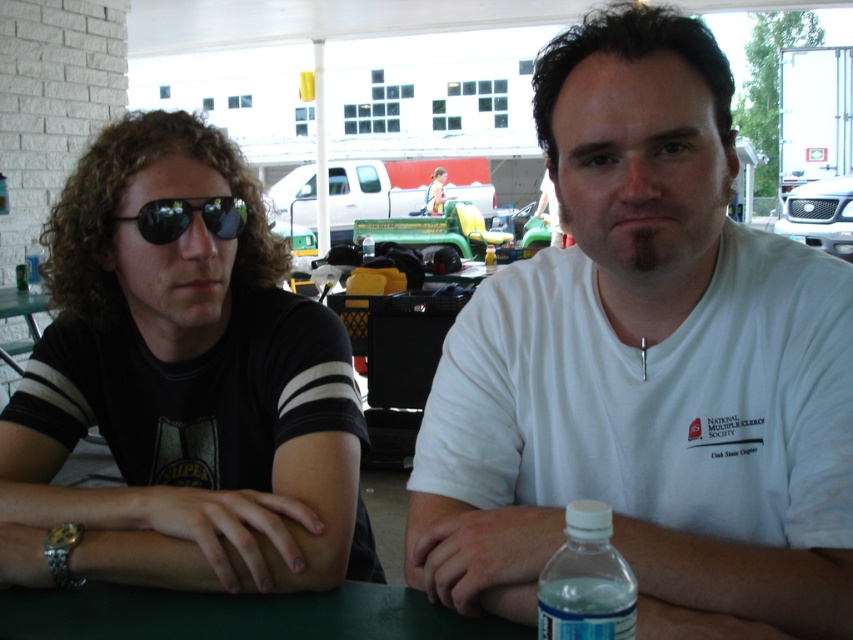
Is point (635, 365) farther from viewer compared to point (579, 544)?

Yes, point (635, 365) is behind point (579, 544).

Who is higher up, white cotton shirt at center or clear plastic bottle at lower center?

white cotton shirt at center

Is point (585, 394) less distant than point (601, 540)?

No, (585, 394) is further to viewer.

At what (x,y) coordinates should I click in order to perform the action: click on white cotton shirt at center. Please return your answer as a coordinate pair (x, y). Looking at the image, I should click on pyautogui.click(x=646, y=368).

From the picture: Which of these two, green matte table at center or clear plastic bottle at lower center, stands shorter?

green matte table at center is shorter.

Can you confirm if green matte table at center is positioned to the left of clear plastic bottle at lower center?

Yes, green matte table at center is to the left of clear plastic bottle at lower center.

Image resolution: width=853 pixels, height=640 pixels. Describe the element at coordinates (241, 614) in the screenshot. I see `green matte table at center` at that location.

Image resolution: width=853 pixels, height=640 pixels. I want to click on green matte table at center, so click(x=241, y=614).

Is clear plastic bottle at lower center above matte yellow toy car at center?

Incorrect, clear plastic bottle at lower center is not positioned above matte yellow toy car at center.

Which is in front, point (589, 557) or point (436, 182)?

Point (589, 557) is more forward.

Is point (563, 596) closer to viewer compared to point (434, 180)?

Yes, it is in front of point (434, 180).

This screenshot has height=640, width=853. Identify the location of clear plastic bottle at lower center. (585, 580).